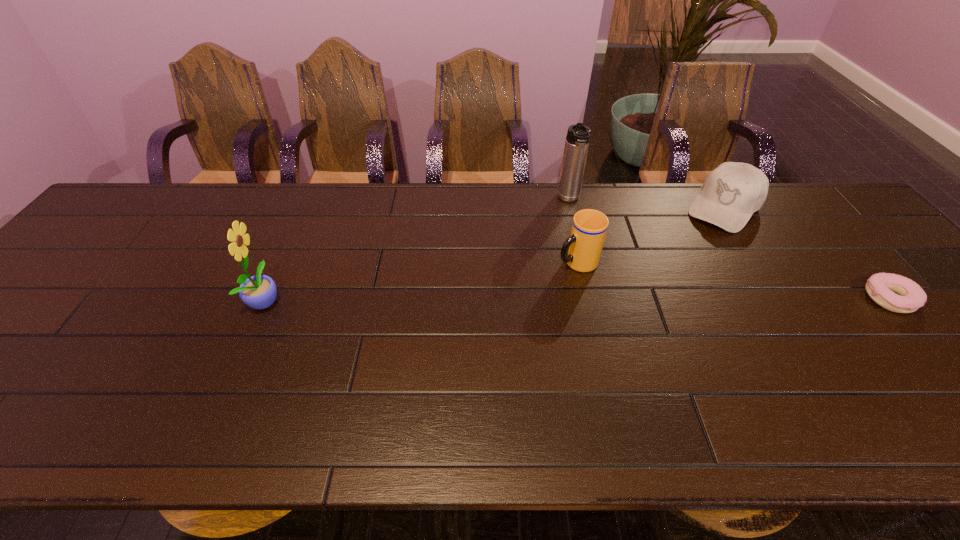
Identify the location of vacant region located 0.290m on the side of the third nearest object with the handle. This screenshot has width=960, height=540. (464, 311).

Find the location of a particular element. This screenshot has width=960, height=540. free space located 0.310m on the front-facing side of the baseball cap is located at coordinates (660, 286).

This screenshot has width=960, height=540. Identify the location of free space located 0.150m on the front-facing side of the baseball cap. (687, 254).

Locate an element on the screen. Image resolution: width=960 pixels, height=540 pixels. vacant region located 0.260m on the front-facing side of the baseball cap is located at coordinates (669, 275).

Identify the location of free location located on the handle side of the thermos bottle. (581, 260).

Find the location of a particular element. Image resolution: width=960 pixels, height=540 pixels. vacant region located 0.120m on the handle side of the thermos bottle is located at coordinates (576, 236).

I want to click on free space located 0.170m on the handle side of the thermos bottle, so (x=578, y=248).

The width and height of the screenshot is (960, 540). Identify the location of baseball cap that is at the far edge. (731, 193).

Where is `thermos bottle that is at the far edge`? This screenshot has width=960, height=540. thermos bottle that is at the far edge is located at coordinates (578, 136).

In order to click on object at the right edge in this screenshot , I will do `click(909, 296)`.